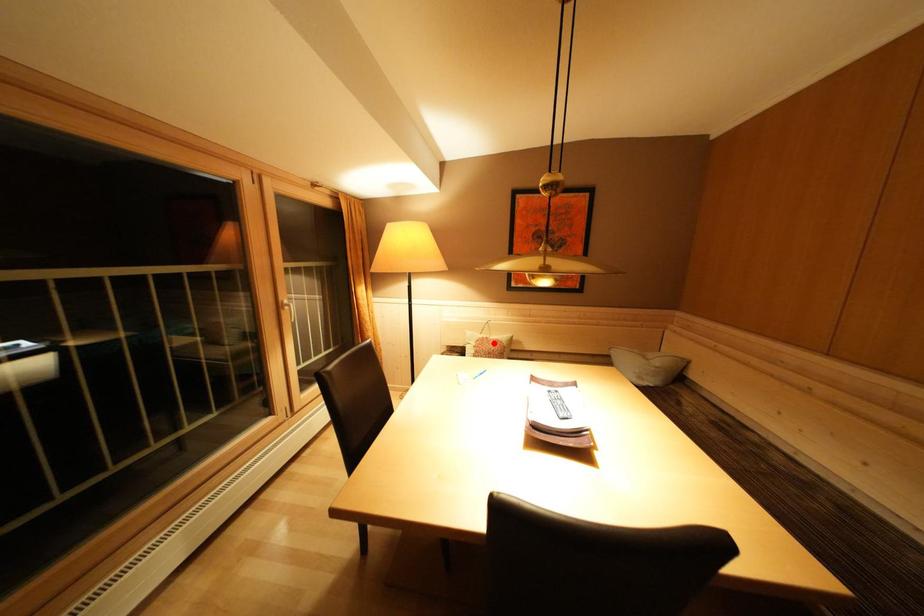
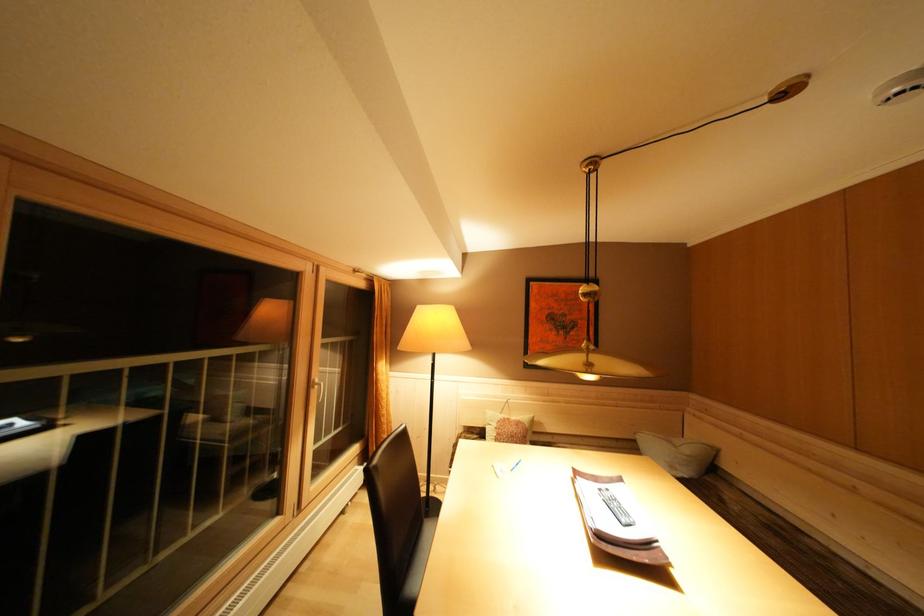
Where in the second image is the point corresponding to the highlighted location from the first image?

(515, 424)